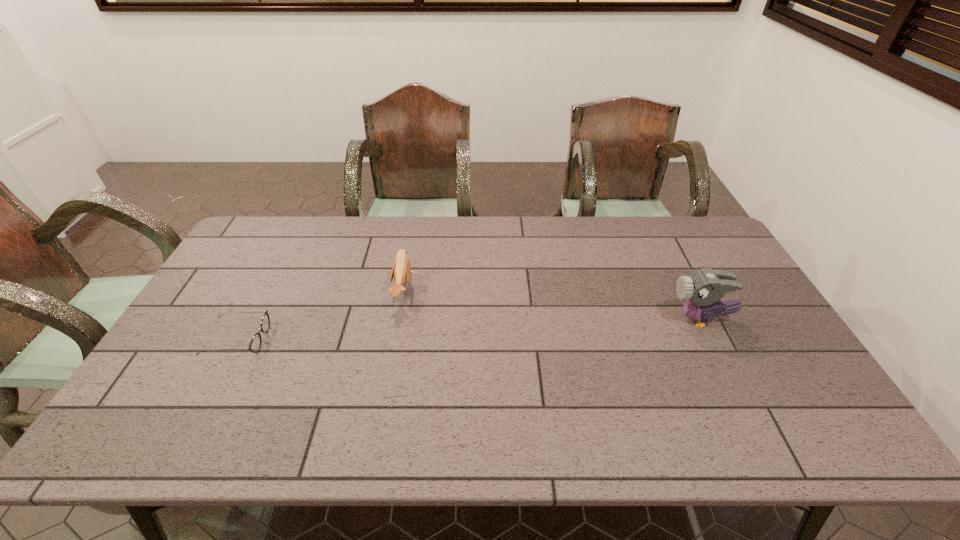
I want to click on vacant space that's between the spectacles and the second object from left to right, so click(x=321, y=315).

You are a GUI agent. You are given a task and a screenshot of the screen. Output one action in this format:
    pyautogui.click(x=<x>, y=<y>)
    Task: Click on the free space that is in between the shortest object and the rightmost object
    Image resolution: width=960 pixels, height=540 pixels.
    Given the screenshot: What is the action you would take?
    pyautogui.click(x=468, y=329)

Identify the location of blank region between the leftmost object and the shorter bird. The image size is (960, 540). (321, 315).

Find the location of a particular element. The width and height of the screenshot is (960, 540). empty space between the spectacles and the second object from left to right is located at coordinates (321, 315).

Locate an element on the screen. vacant space that's between the rightmost object and the shortest object is located at coordinates (468, 329).

Locate an element on the screen. This screenshot has height=540, width=960. empty space that is in between the left bird and the right bird is located at coordinates (552, 305).

Identify the location of vacant area that lies between the tallest object and the shortest object. (468, 329).

Select which object appears as the second closest to the left bird. Please provide its 2D coordinates. Your answer should be formatted as a tuple, i.e. [(x, y)], where the tuple contains the x and y coordinates of a point satisfying the conditions above.

[(703, 288)]

At what (x,y) coordinates should I click in order to perform the action: click on object that is the second closest to the leftmost object. Please return your answer as a coordinate pair (x, y). This screenshot has width=960, height=540. Looking at the image, I should click on (703, 288).